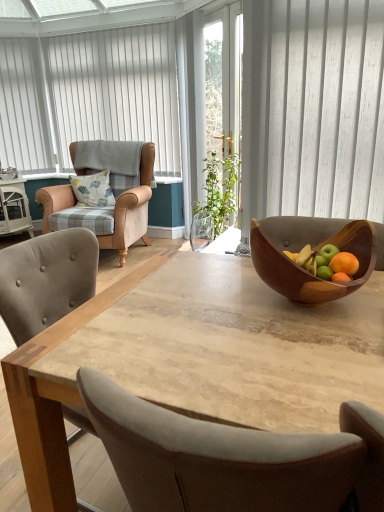
Question: From a real-world perspective, is beige leather armchair at left positioned over wooden bowl at center based on gravity?

Choices:
 (A) no
 (B) yes

Answer: (A)

Question: Considering the relative sizes of beige leather armchair at left and wooden bowl at center in the image provided, is beige leather armchair at left wider than wooden bowl at center?

Choices:
 (A) no
 (B) yes

Answer: (B)

Question: Can you confirm if beige leather armchair at left is positioned to the left of wooden bowl at center?

Choices:
 (A) no
 (B) yes

Answer: (B)

Question: Can you confirm if beige leather armchair at left is taller than wooden bowl at center?

Choices:
 (A) no
 (B) yes

Answer: (B)

Question: Would you say beige leather armchair at left is a long distance from wooden bowl at center?

Choices:
 (A) no
 (B) yes

Answer: (B)

Question: In the image, is beige leather armchair at left positioned in front of or behind transparent glass screen door at center?

Choices:
 (A) front
 (B) behind

Answer: (A)

Question: Looking at their shapes, would you say beige leather armchair at left is wider or thinner than transparent glass screen door at center?

Choices:
 (A) wide
 (B) thin

Answer: (A)

Question: Is beige leather armchair at left taller or shorter than transparent glass screen door at center?

Choices:
 (A) tall
 (B) short

Answer: (B)

Question: From a real-world perspective, is beige leather armchair at left physically located above or below transparent glass screen door at center?

Choices:
 (A) above
 (B) below

Answer: (B)

Question: Is point (84, 189) closer or farther from the camera than point (48, 224)?

Choices:
 (A) farther
 (B) closer

Answer: (A)

Question: Is floral fabric pillow at left spatially inside beige leather armchair at left, or outside of it?

Choices:
 (A) outside
 (B) inside

Answer: (B)

Question: Relative to beige leather armchair at left, is floral fabric pillow at left in front or behind?

Choices:
 (A) front
 (B) behind

Answer: (B)

Question: Looking at the image, does floral fabric pillow at left seem bigger or smaller compared to beige leather armchair at left?

Choices:
 (A) big
 (B) small

Answer: (B)

Question: Considering the positions of wooden bowl at center and transparent glass screen door at center in the image, is wooden bowl at center bigger or smaller than transparent glass screen door at center?

Choices:
 (A) small
 (B) big

Answer: (A)

Question: Visually, is wooden bowl at center positioned to the left or to the right of transparent glass screen door at center?

Choices:
 (A) left
 (B) right

Answer: (B)